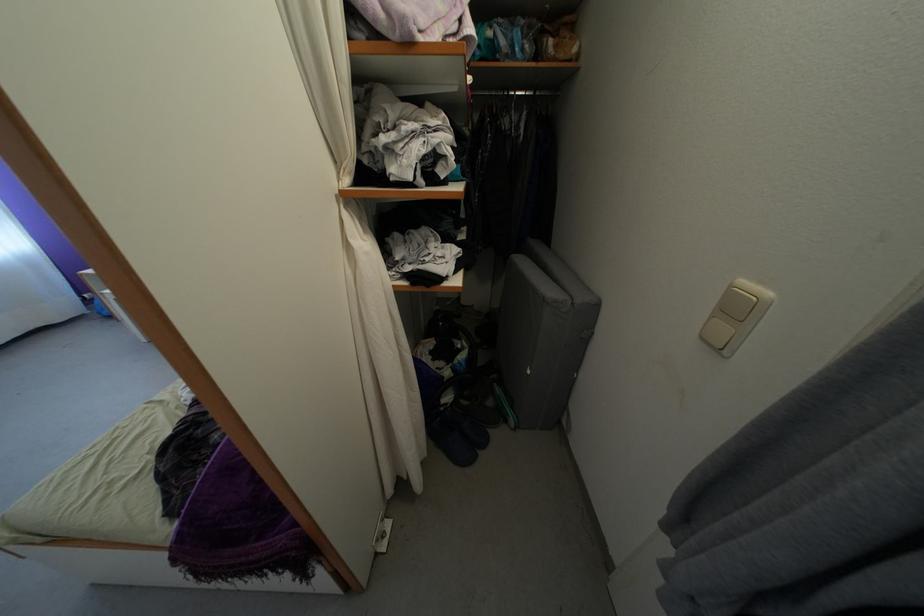
Find the location of `clothes hanger hook`. clothes hanger hook is located at coordinates (515, 103).